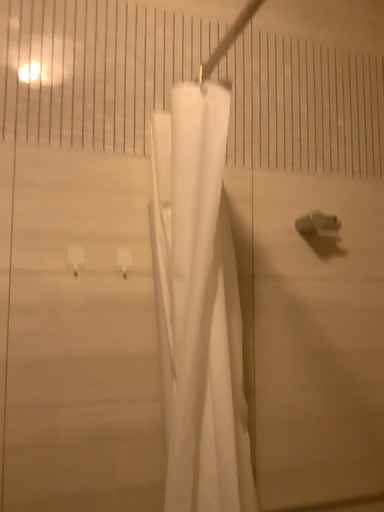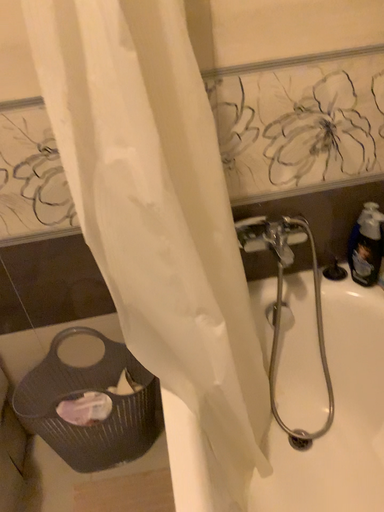
Question: How did the camera likely rotate when shooting the video?

Choices:
 (A) rotated upward
 (B) rotated downward

Answer: (B)